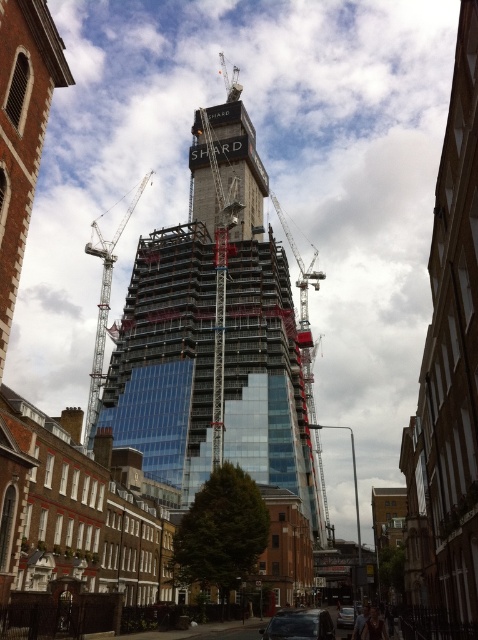
Question: Is metallic gray crane at left behind metallic silver car at center?

Choices:
 (A) no
 (B) yes

Answer: (B)

Question: Considering the relative positions of glassy steel tower at center and metallic gray crane at center in the image provided, where is glassy steel tower at center located with respect to metallic gray crane at center?

Choices:
 (A) below
 (B) above

Answer: (B)

Question: Is the position of metallic silver car at lower center less distant than that of metallic silver car at center?

Choices:
 (A) yes
 (B) no

Answer: (A)

Question: Which of the following is the farthest from the observer?

Choices:
 (A) metallic silver car at center
 (B) glassy steel tower at center
 (C) metallic silver car at lower center
 (D) metallic gray crane at center

Answer: (D)

Question: Which object is farther from the camera taking this photo?

Choices:
 (A) metallic silver car at lower center
 (B) glassy steel tower at center

Answer: (B)

Question: Which of the following is the closest to the observer?

Choices:
 (A) glassy steel tower at center
 (B) metallic gray crane at left

Answer: (A)